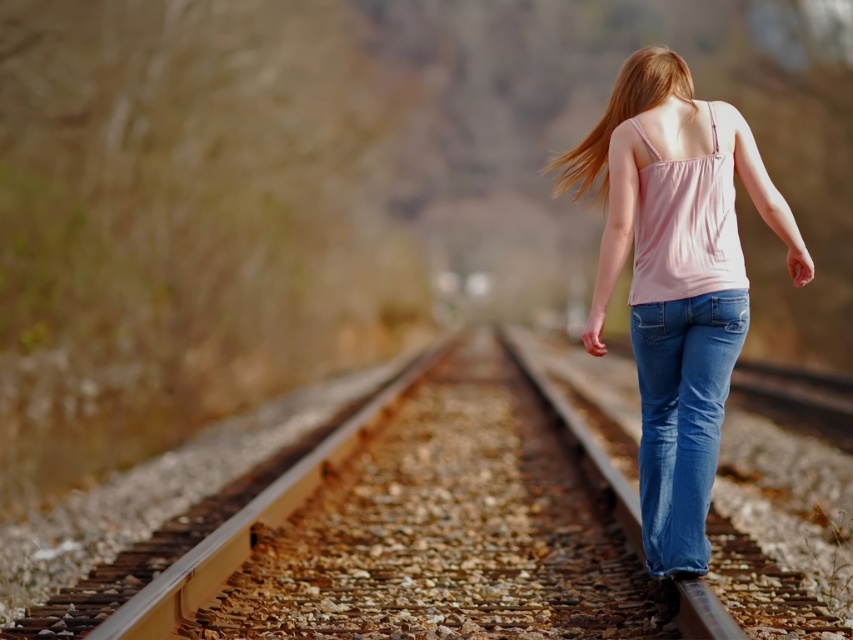
Is brown gravel train track at center below blonde silky hair at center?

Yes.

Which is above, brown gravel train track at center or blonde silky hair at center?

blonde silky hair at center

At what (x,y) coordinates should I click in order to perform the action: click on brown gravel train track at center. Please return your answer as a coordinate pair (x, y). The image size is (853, 640). Looking at the image, I should click on (444, 528).

Image resolution: width=853 pixels, height=640 pixels. I want to click on brown gravel train track at center, so click(444, 528).

Which is more to the right, brown gravel train track at center or blue denim jeans at center?

blue denim jeans at center

Describe the element at coordinates (444, 528) in the screenshot. This screenshot has width=853, height=640. I see `brown gravel train track at center` at that location.

Locate an element on the screen. This screenshot has width=853, height=640. brown gravel train track at center is located at coordinates (444, 528).

Locate an element on the screen. Image resolution: width=853 pixels, height=640 pixels. brown gravel train track at center is located at coordinates tap(444, 528).

Which of these two, brown gravel train track at center or pink cotton tank top at center, stands taller?

pink cotton tank top at center

Who is more forward, (329,577) or (601,256)?

Positioned in front is point (601,256).

This screenshot has width=853, height=640. Identify the location of brown gravel train track at center. (444, 528).